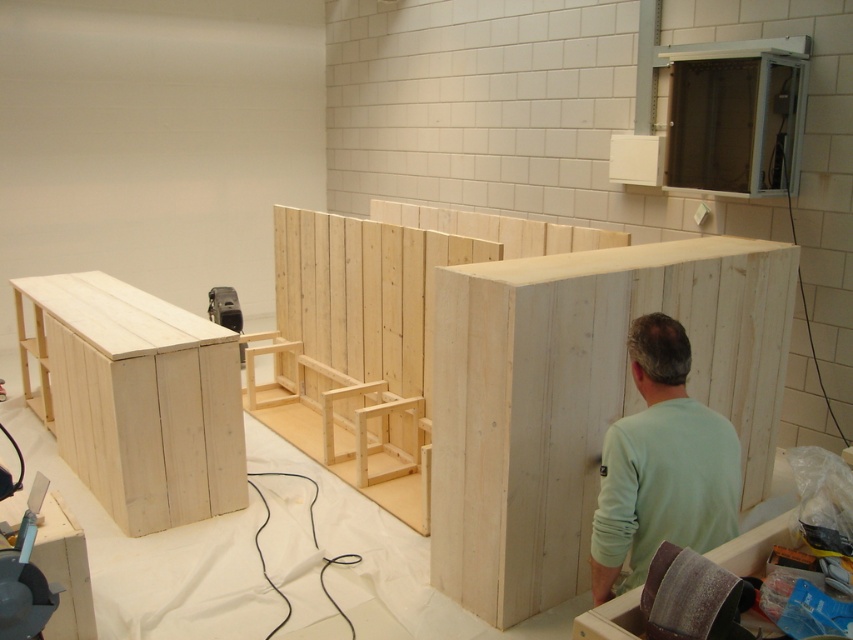
Question: Is natural wood cabinet at center below light green fabric at center?

Choices:
 (A) yes
 (B) no

Answer: (B)

Question: Can you confirm if natural wood cabinet at center is positioned below light green fabric at center?

Choices:
 (A) no
 (B) yes

Answer: (A)

Question: Which point is farther from the camera taking this photo?

Choices:
 (A) (634, 458)
 (B) (479, 614)

Answer: (B)

Question: Is natural wood cabinet at center below light green fabric at center?

Choices:
 (A) no
 (B) yes

Answer: (A)